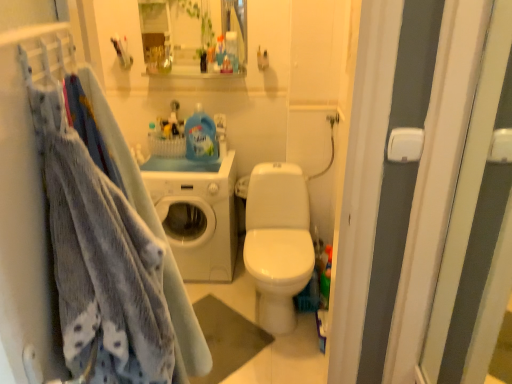
Question: Could you tell me if matte white cabinet at upper center is turned towards white glossy washing machine at center?

Choices:
 (A) yes
 (B) no

Answer: (B)

Question: Would you say matte white cabinet at upper center is a long distance from white glossy washing machine at center?

Choices:
 (A) no
 (B) yes

Answer: (B)

Question: Is matte white cabinet at upper center thinner than white glossy washing machine at center?

Choices:
 (A) no
 (B) yes

Answer: (B)

Question: Considering the relative sizes of matte white cabinet at upper center and white glossy washing machine at center in the image provided, is matte white cabinet at upper center taller than white glossy washing machine at center?

Choices:
 (A) yes
 (B) no

Answer: (B)

Question: Can you confirm if matte white cabinet at upper center is wider than white glossy washing machine at center?

Choices:
 (A) yes
 (B) no

Answer: (B)

Question: Is soft blue fabric at left to the left or to the right of matte white cabinet at upper center in the image?

Choices:
 (A) left
 (B) right

Answer: (B)

Question: Considering the positions of soft blue fabric at left and matte white cabinet at upper center in the image, is soft blue fabric at left wider or thinner than matte white cabinet at upper center?

Choices:
 (A) wide
 (B) thin

Answer: (B)

Question: From the image's perspective, relative to matte white cabinet at upper center, is soft blue fabric at left above or below?

Choices:
 (A) above
 (B) below

Answer: (B)

Question: Is point (22, 82) positioned closer to the camera than point (241, 11)?

Choices:
 (A) closer
 (B) farther

Answer: (A)

Question: Is white glossy washing machine at center inside or outside of soft blue fabric at left?

Choices:
 (A) inside
 (B) outside

Answer: (B)

Question: From the image's perspective, is white glossy washing machine at center positioned above or below soft blue fabric at left?

Choices:
 (A) above
 (B) below

Answer: (A)

Question: From a real-world perspective, is white glossy washing machine at center positioned above or below soft blue fabric at left?

Choices:
 (A) below
 (B) above

Answer: (A)

Question: Is white glossy washing machine at center wider or thinner than soft blue fabric at left?

Choices:
 (A) wide
 (B) thin

Answer: (A)

Question: Does point (11, 132) appear closer or farther from the camera than point (229, 172)?

Choices:
 (A) closer
 (B) farther

Answer: (A)

Question: From a real-world perspective, relative to white glossy washing machine at center, is soft blue fabric at left vertically above or below?

Choices:
 (A) above
 (B) below

Answer: (A)